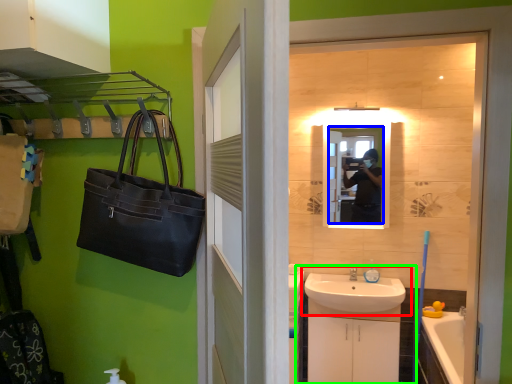
Question: Which is farther away from sink (highlighted by a red box)? mirror (highlighted by a blue box) or bathroom cabinet (highlighted by a green box)?

Choices:
 (A) mirror
 (B) bathroom cabinet

Answer: (A)